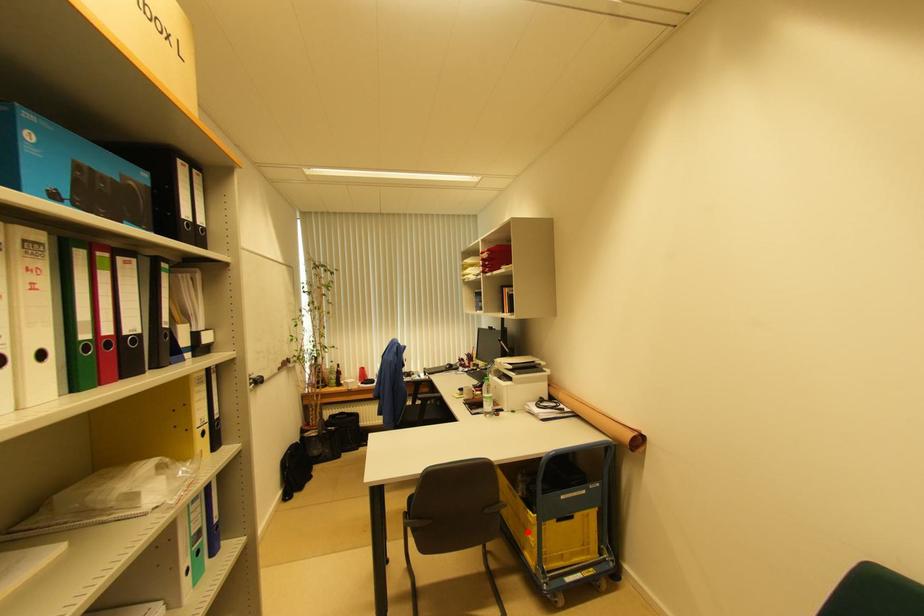
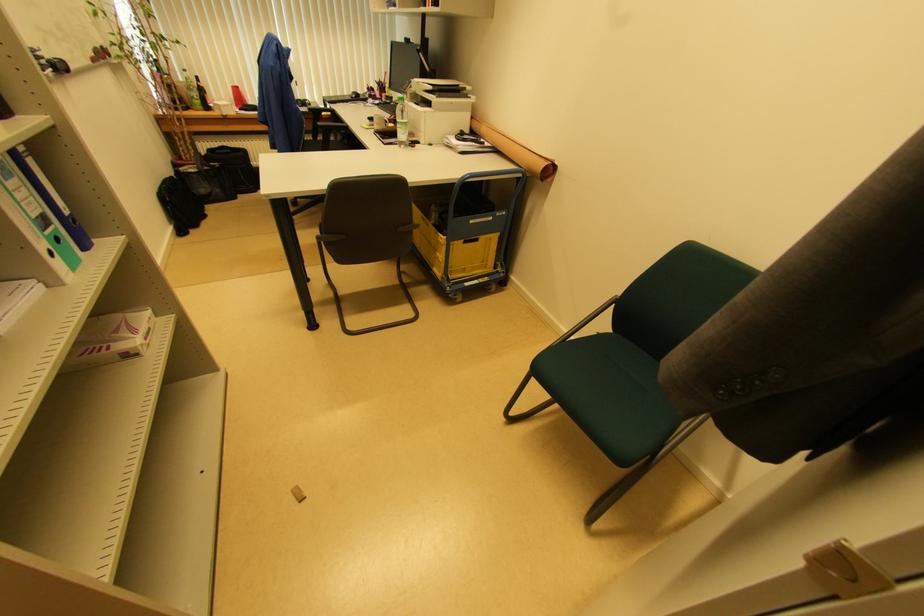
Question: A red point is marked in image1. In image2, is the corresponding 3D point closer to the camera or farther? Reply with the corresponding letter.

Choices:
 (A) The corresponding 3D point is closer.
 (B) The corresponding 3D point is farther.

Answer: (A)